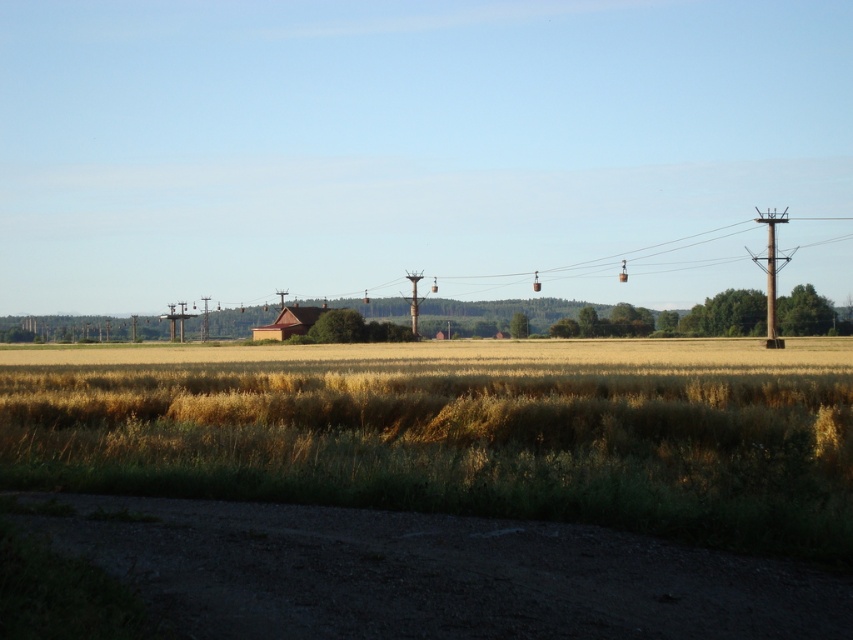
Is yellow grassy wheat field at center closer to the viewer compared to metallic gray telegraph pole at center?

That is True.

Looking at this image, between yellow grassy wheat field at center and metallic gray telegraph pole at center, which one appears on the right side from the viewer's perspective?

yellow grassy wheat field at center

Between point (672, 404) and point (409, 304), which one is positioned behind?

The point (409, 304) is behind.

Identify the location of yellow grassy wheat field at center. (459, 429).

Does brown wooden hut at center come in front of metallic gray telegraph pole at center?

Yes, it is in front of metallic gray telegraph pole at center.

Is brown wooden hut at center bigger than metallic gray telegraph pole at center?

No, brown wooden hut at center is not bigger than metallic gray telegraph pole at center.

Between point (308, 310) and point (413, 289), which one is positioned behind?

Point (413, 289)

Locate an element on the screen. This screenshot has height=640, width=853. brown wooden hut at center is located at coordinates (288, 323).

Between yellow grassy wheat field at center and brown wooden telegraph pole at right, which one is positioned lower?

Positioned lower is yellow grassy wheat field at center.

What are the coordinates of `yellow grassy wheat field at center` in the screenshot? It's located at (459, 429).